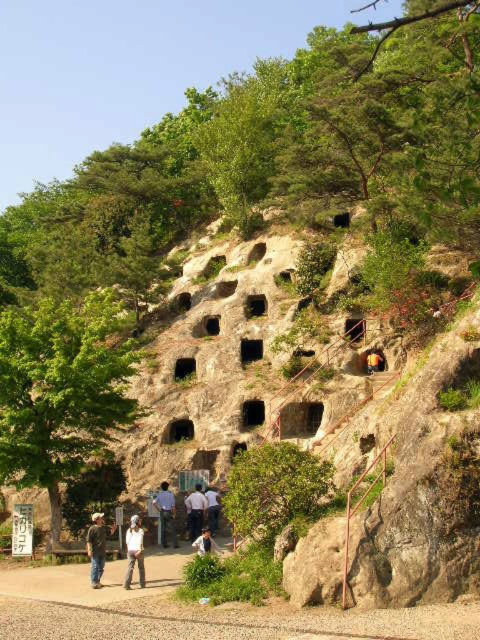
Which is more to the left, white cotton shirt at lower center or yellow fabric at center?

white cotton shirt at lower center is more to the left.

Who is taller, white cotton shirt at lower center or yellow fabric at center?

With more height is white cotton shirt at lower center.

Locate an element on the screen. The image size is (480, 640). white cotton shirt at lower center is located at coordinates (134, 552).

Where is `white cotton shirt at lower center`? This screenshot has height=640, width=480. white cotton shirt at lower center is located at coordinates (134, 552).

Who is more distant from viewer, (156,506) or (368,372)?

Positioned behind is point (368,372).

Locate an element on the screen. white shirt at center is located at coordinates point(166,515).

Is point (193, 536) positioned before point (215, 532)?

Yes, point (193, 536) is closer to viewer.

Which is behind, point (195, 531) or point (217, 500)?

Positioned behind is point (217, 500).

Between point (193, 497) and point (214, 492), which one is positioned behind?

Point (214, 492)

The width and height of the screenshot is (480, 640). In order to click on light blue jeans at center in this screenshot , I will do `click(194, 512)`.